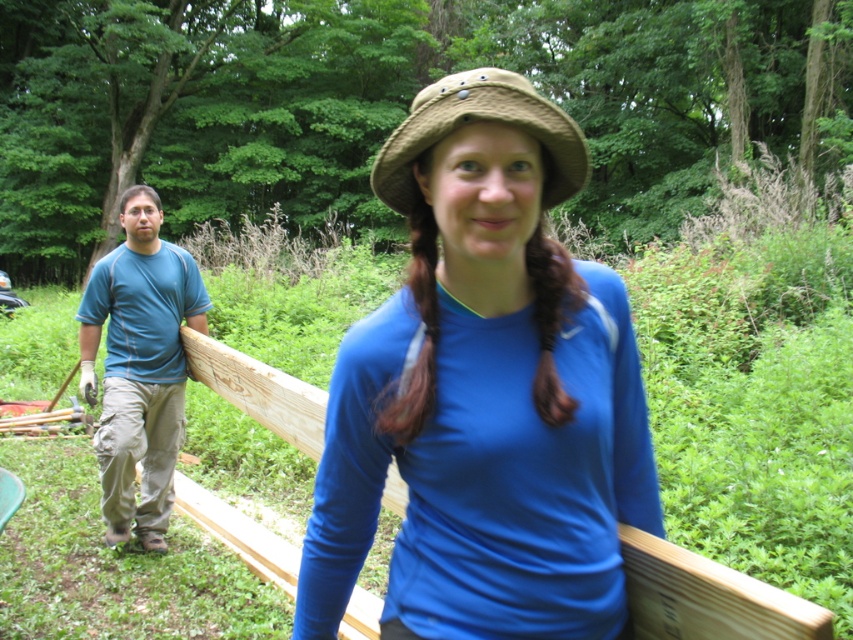
You are observing two people in a wooded area. The first person wears a blue matte shirt at center, and the second wears a blue cotton shirt at left. Which person is shorter?

The blue matte shirt at center is not as tall as the blue cotton shirt at left, so the person wearing the blue matte shirt at center is shorter.

You are a photographer trying to capture both the blue matte shirt at center and the blue cotton shirt at left in a single shot. Based on their positions, which shirt will appear larger in the photo?

The blue matte shirt at center will appear larger in the photo because it is closer to the viewer than the blue cotton shirt at left.